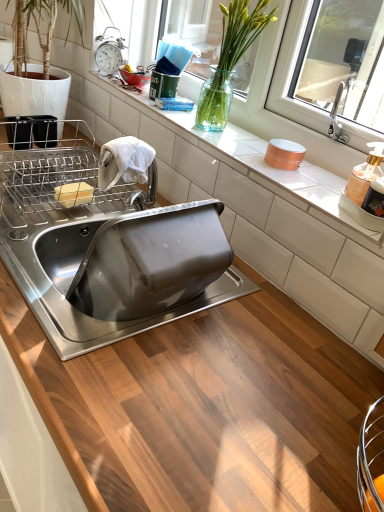
You are a GUI agent. You are given a task and a screenshot of the screen. Output one action in this format:
    pyautogui.click(x=<x>, y=<y>)
    Task: Click on the free space to the back side of yellow butter at upper left
    The height and width of the screenshot is (512, 384).
    Given the screenshot: What is the action you would take?
    pyautogui.click(x=64, y=174)